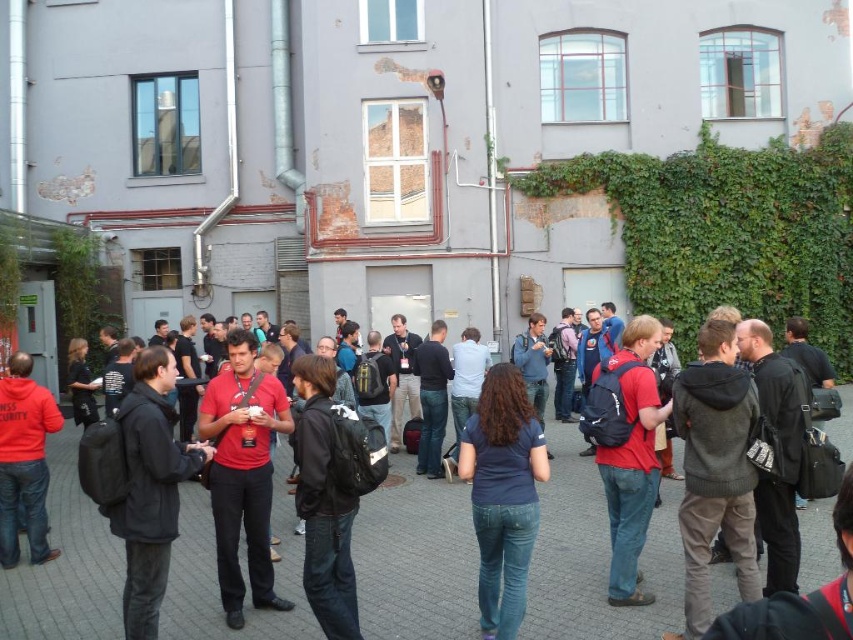
You are standing in front of the building and want to take a photo of both the point at coordinates (393, 548) and the point at (683, 198). Based on their positions, which point should you focus on first to ensure both are in clear view?

You should focus on point (393, 548) first because it is closer to the camera than point (683, 198), ensuring both points are in focus when using a camera with a fixed focal length.

You are standing in front of the industrial building and notice a black backpack at center and a green leafy ivy at center right. Which object is closer to your right side?

The green leafy ivy at center right is closer to your right side since it is positioned to the right of the black backpack at center.

You are organizing a small outdoor event and need to place a table between the black backpack at center and the green leafy ivy at center right. Based on their sizes, which object should you place the table closer to?

The black backpack at center occupies less space than the green leafy ivy at center right, so you should place the table closer to the black backpack at center to accommodate the ivy.